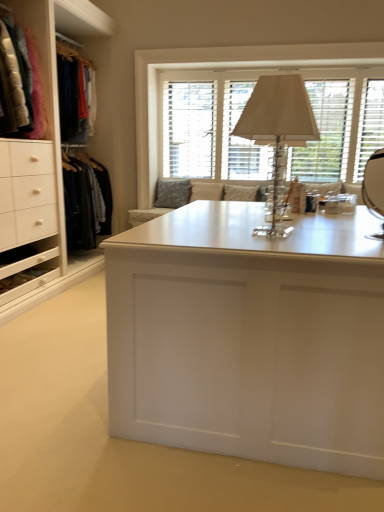
The height and width of the screenshot is (512, 384). In order to click on clear crystal table lamp at center in this screenshot , I will do `click(277, 123)`.

Image resolution: width=384 pixels, height=512 pixels. Describe the element at coordinates (277, 123) in the screenshot. I see `clear crystal table lamp at center` at that location.

The width and height of the screenshot is (384, 512). Describe the element at coordinates (249, 337) in the screenshot. I see `white matte desk at center` at that location.

What do you see at coordinates (172, 193) in the screenshot? This screenshot has height=512, width=384. I see `textured gray pillow at center` at bounding box center [172, 193].

The width and height of the screenshot is (384, 512). Identify the location of velvet jackets at left. point(28,79).

Considering their positions, is white matte desk at center located in front of or behind velvet jackets at left?

white matte desk at center is positioned closer to the viewer than velvet jackets at left.

Is white matte desk at center next to velvet jackets at left and touching it?

white matte desk at center and velvet jackets at left are clearly separated.

From a real-world perspective, is white matte desk at center located higher than velvet jackets at left?

Actually, white matte desk at center is physically below velvet jackets at left in the real world.

Is white matte desk at center aimed at velvet jackets at left?

No, white matte desk at center is not facing towards velvet jackets at left.

Which point is more distant from viewer, (16, 54) or (380, 246)?

The point (16, 54) is farther from the camera.

Does velvet jackets at left have a lesser height compared to white matte desk at center?

No, velvet jackets at left is not shorter than white matte desk at center.

Is velvet jackets at left oriented towards white matte desk at center?

No, velvet jackets at left is not aimed at white matte desk at center.

In terms of height, does textured gray pillow at center look taller or shorter compared to white wood window at upper center?

Clearly, textured gray pillow at center is shorter compared to white wood window at upper center.

You are a GUI agent. You are given a task and a screenshot of the screen. Output one action in this format:
    pyautogui.click(x=<x>, y=<y>)
    Task: Click on the pillow located behind the white wood window at upper center
    This screenshot has width=384, height=512.
    Given the screenshot: What is the action you would take?
    pyautogui.click(x=172, y=193)

Does white wood window at upper center have a greater width compared to velvet jackets at left?

No, white wood window at upper center is not wider than velvet jackets at left.

Is white wood window at upper center far from velvet jackets at left?

Yes.

Which is less distant, (221, 56) or (34, 90)?

The point (34, 90) is more forward.

From the image's perspective, is white wood window at upper center above velvet jackets at left?

Yes.

Is white wood window at upper center behind textured gray pillow at center?

No.

At what (x,y) coordinates should I click in order to perform the action: click on window located on the right of textured gray pillow at center. Please return your answer as a coordinate pair (x, y). This screenshot has height=512, width=384. Looking at the image, I should click on (221, 68).

From the picture: Considering the relative sizes of white wood window at upper center and textured gray pillow at center in the image provided, is white wood window at upper center shorter than textured gray pillow at center?

No.

Between white wood window at upper center and textured gray pillow at center, which one appears on the left side from the viewer's perspective?

textured gray pillow at center is more to the left.

Considering the sizes of objects clear crystal table lamp at center and white wood window at upper center in the image provided, who is thinner, clear crystal table lamp at center or white wood window at upper center?

Thinner between the two is white wood window at upper center.

Between clear crystal table lamp at center and white wood window at upper center, which one appears on the right side from the viewer's perspective?

From the viewer's perspective, white wood window at upper center appears more on the right side.

Is clear crystal table lamp at center located outside white wood window at upper center?

Yes, clear crystal table lamp at center is not within white wood window at upper center.

Would you say textured gray pillow at center is inside or outside clear crystal table lamp at center?

textured gray pillow at center is not inside clear crystal table lamp at center, it's outside.

Can you see textured gray pillow at center touching clear crystal table lamp at center?

No, textured gray pillow at center is not with clear crystal table lamp at center.

Visually, is textured gray pillow at center positioned to the left or to the right of clear crystal table lamp at center?

From the image, it's evident that textured gray pillow at center is to the left of clear crystal table lamp at center.

From the image's perspective, does textured gray pillow at center appear lower than clear crystal table lamp at center?

Actually, textured gray pillow at center appears above clear crystal table lamp at center in the image.

Locate an element on the screen. The width and height of the screenshot is (384, 512). clothing behind the white matte desk at center is located at coordinates (28, 79).

Where is `clothing above the white matte desk at center (from a real-world perspective)`? clothing above the white matte desk at center (from a real-world perspective) is located at coordinates (28, 79).

Considering their positions, is white wood window at upper center positioned further to white matte desk at center than velvet jackets at left?

Among the two, white wood window at upper center is located further to white matte desk at center.

From the picture: Considering their positions, is white wood window at upper center positioned closer to textured gray pillow at center than clear crystal table lamp at center?

white wood window at upper center lies closer to textured gray pillow at center than the other object.

Looking at the image, which one is located further to textured gray pillow at center, white matte desk at center or clear crystal table lamp at center?

white matte desk at center is positioned further to the anchor textured gray pillow at center.

Considering their positions, is textured gray pillow at center positioned closer to clear crystal table lamp at center than white matte desk at center?

Among the two, white matte desk at center is located nearer to clear crystal table lamp at center.

Which object lies further to the anchor point white matte desk at center, clear crystal table lamp at center or velvet jackets at left?

Among the two, velvet jackets at left is located further to white matte desk at center.

Considering their positions, is white wood window at upper center positioned closer to white matte desk at center than clear crystal table lamp at center?

Among the two, clear crystal table lamp at center is located nearer to white matte desk at center.

Considering their positions, is clear crystal table lamp at center positioned closer to white wood window at upper center than textured gray pillow at center?

textured gray pillow at center.

Based on their spatial positions, is clear crystal table lamp at center or white matte desk at center closer to textured gray pillow at center?

clear crystal table lamp at center is closer to textured gray pillow at center.

At what (x,y) coordinates should I click in order to perform the action: click on clothing between white matte desk at center and white wood window at upper center along the z-axis. Please return your answer as a coordinate pair (x, y). Looking at the image, I should click on (28, 79).

The image size is (384, 512). I want to click on table lamp between white matte desk at center and white wood window at upper center from front to back, so click(277, 123).

Identify the location of table lamp between velvet jackets at left and white matte desk at center in the vertical direction. (277, 123).

Locate an element on the screen. clothing positioned between clear crystal table lamp at center and white wood window at upper center from near to far is located at coordinates (28, 79).